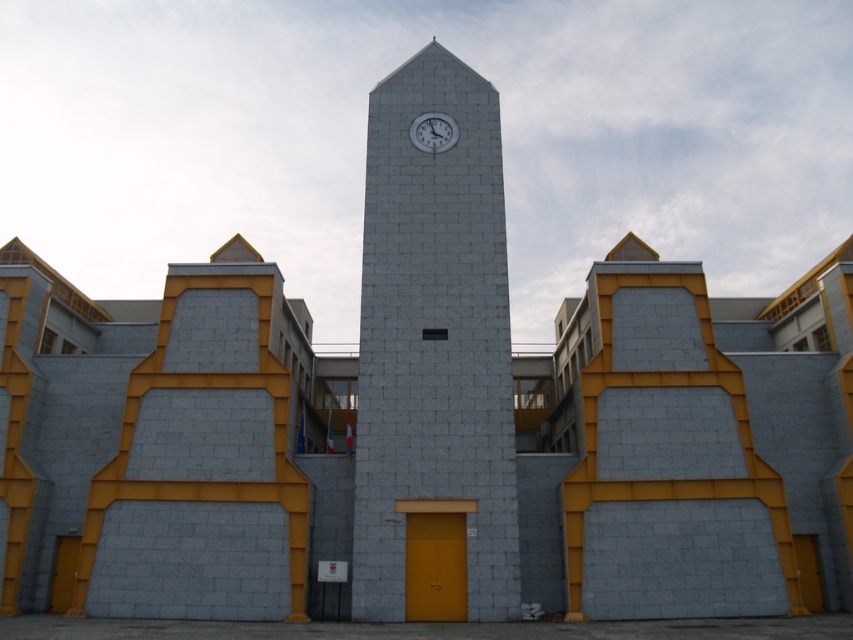
Can you confirm if gray stone clock tower at center is positioned below white glossy clock at upper center?

Yes, gray stone clock tower at center is below white glossy clock at upper center.

Does gray stone clock tower at center lie in front of white glossy clock at upper center?

Yes.

Is point (358, 436) less distant than point (440, 145)?

Yes, it is in front of point (440, 145).

This screenshot has height=640, width=853. What are the coordinates of `gray stone clock tower at center` in the screenshot? It's located at (436, 339).